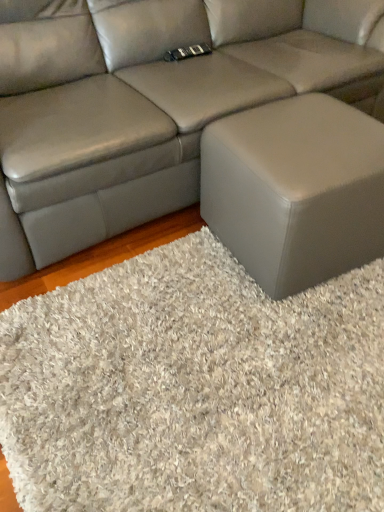
What is the approximate width of white shaggy rug at lower right?

white shaggy rug at lower right is 3.33 feet wide.

In order to face matte gray ottoman at lower right, should I rotate leftwards or rightwards?

Turn right by 14.783 degrees to look at matte gray ottoman at lower right.

This screenshot has height=512, width=384. What do you see at coordinates (295, 190) in the screenshot?
I see `matte gray ottoman at lower right` at bounding box center [295, 190].

Locate an element on the screen. The height and width of the screenshot is (512, 384). white shaggy rug at lower right is located at coordinates (195, 389).

Which object is closer to the camera, white shaggy rug at lower right or matte gray ottoman at lower right?

white shaggy rug at lower right is more forward.

Where is `stool above the white shaggy rug at lower right (from the image's perspective)`? The width and height of the screenshot is (384, 512). stool above the white shaggy rug at lower right (from the image's perspective) is located at coordinates (295, 190).

From a real-world perspective, is white shaggy rug at lower right beneath matte gray ottoman at lower right?

Indeed, from a real-world perspective, white shaggy rug at lower right is positioned beneath matte gray ottoman at lower right.

Who is smaller, white shaggy rug at lower right or matte gray ottoman at lower right?

With smaller size is white shaggy rug at lower right.

From a real-world perspective, which is physically below, white shaggy rug at lower right or matte gray leather couch at center?

white shaggy rug at lower right is physically lower.

Looking at this image, could you tell me if white shaggy rug at lower right is turned towards matte gray leather couch at center?

No, white shaggy rug at lower right is not turned towards matte gray leather couch at center.

Considering the relative positions of white shaggy rug at lower right and matte gray leather couch at center in the image provided, is white shaggy rug at lower right to the right of matte gray leather couch at center from the viewer's perspective?

Indeed, white shaggy rug at lower right is positioned on the right side of matte gray leather couch at center.

Do you think white shaggy rug at lower right is within matte gray leather couch at center, or outside of it?

The correct answer is: outside.

Considering the positions of objects matte gray ottoman at lower right and white shaggy rug at lower right in the image provided, who is more to the left, matte gray ottoman at lower right or white shaggy rug at lower right?

From the viewer's perspective, white shaggy rug at lower right appears more on the left side.

From a real-world perspective, is matte gray ottoman at lower right positioned under white shaggy rug at lower right based on gravity?

No.

Are matte gray ottoman at lower right and white shaggy rug at lower right making contact?

No, matte gray ottoman at lower right is not touching white shaggy rug at lower right.

Which point is more distant from viewer, (308, 170) or (215, 25)?

The point (215, 25) is farther from the camera.

From the image's perspective, which one is positioned higher, matte gray ottoman at lower right or matte gray leather couch at center?

matte gray leather couch at center.

This screenshot has height=512, width=384. Find the location of `stool below the matte gray leather couch at center (from the image's perspective)`. stool below the matte gray leather couch at center (from the image's perspective) is located at coordinates (295, 190).

From a real-world perspective, is matte gray leather couch at center under matte gray ottoman at lower right?

No.

Considering the positions of points (73, 108) and (240, 167), is point (73, 108) closer to camera compared to point (240, 167)?

That is False.

Is matte gray leather couch at center shorter than matte gray ottoman at lower right?

No, matte gray leather couch at center is not shorter than matte gray ottoman at lower right.

What's the angular difference between matte gray leather couch at center and matte gray ottoman at lower right's facing directions?

The angular difference between matte gray leather couch at center and matte gray ottoman at lower right is 3.13 degrees.

In terms of height, does matte gray leather couch at center look taller or shorter compared to white shaggy rug at lower right?

In the image, matte gray leather couch at center appears to be taller than white shaggy rug at lower right.

Would you say matte gray leather couch at center is inside or outside white shaggy rug at lower right?

matte gray leather couch at center is located beyond the bounds of white shaggy rug at lower right.

From a real-world perspective, between matte gray leather couch at center and white shaggy rug at lower right, who is vertically higher?

matte gray leather couch at center is physically above.

Can you tell me how much matte gray leather couch at center and white shaggy rug at lower right differ in facing direction?

There is a 1.07-degree angle between the facing directions of matte gray leather couch at center and white shaggy rug at lower right.

Locate an element on the screen. Image resolution: width=384 pixels, height=512 pixels. stool on the right of white shaggy rug at lower right is located at coordinates (295, 190).

At what (x,y) coordinates should I click in order to perform the action: click on studio couch above the white shaggy rug at lower right (from the image's perspective). Please return your answer as a coordinate pair (x, y). This screenshot has height=512, width=384. Looking at the image, I should click on (148, 102).

From the image, which object appears to be nearer to white shaggy rug at lower right, matte gray ottoman at lower right or matte gray leather couch at center?

matte gray ottoman at lower right is closer to white shaggy rug at lower right.

Estimate the real-world distances between objects in this image. Which object is closer to white shaggy rug at lower right, matte gray leather couch at center or matte gray ottoman at lower right?

Based on the image, matte gray ottoman at lower right appears to be nearer to white shaggy rug at lower right.

Which object lies nearer to the anchor point matte gray leather couch at center, white shaggy rug at lower right or matte gray ottoman at lower right?

Among the two, matte gray ottoman at lower right is located nearer to matte gray leather couch at center.

From the image, which object appears to be farther from matte gray leather couch at center, matte gray ottoman at lower right or white shaggy rug at lower right?

Based on the image, white shaggy rug at lower right appears to be further to matte gray leather couch at center.

From the image, which object appears to be farther from matte gray ottoman at lower right, white shaggy rug at lower right or matte gray leather couch at center?

Based on the image, matte gray leather couch at center appears to be further to matte gray ottoman at lower right.

Considering their positions, is matte gray leather couch at center positioned further to matte gray ottoman at lower right than white shaggy rug at lower right?

Among the two, matte gray leather couch at center is located further to matte gray ottoman at lower right.

What are the coordinates of `stool that lies between matte gray leather couch at center and white shaggy rug at lower right from top to bottom` in the screenshot? It's located at (295, 190).